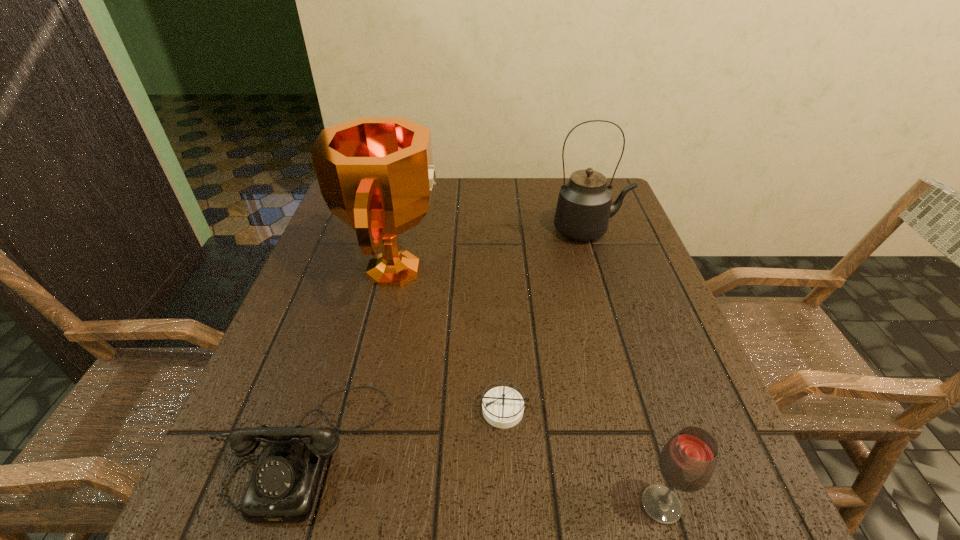
Where is `unoccupied area between the award and the glass drink container`? unoccupied area between the award and the glass drink container is located at coordinates (528, 387).

The width and height of the screenshot is (960, 540). What are the coordinates of `vacant space that's between the third shortest object and the award` in the screenshot? It's located at (528, 387).

Identify the location of empty space between the kettle and the fourth tallest object. This screenshot has width=960, height=540. coord(447,339).

The height and width of the screenshot is (540, 960). Find the location of `object that can be found as the second closest to the telephone`. object that can be found as the second closest to the telephone is located at coordinates (503, 407).

You are a GUI agent. You are given a task and a screenshot of the screen. Output one action in this format:
    pyautogui.click(x=<x>, y=<y>)
    Task: Click on the object that is the fourth closest to the third shortest object
    Image resolution: width=960 pixels, height=540 pixels.
    Given the screenshot: What is the action you would take?
    pyautogui.click(x=584, y=206)

Find the location of a particular element. Image resolution: width=960 pixels, height=540 pixels. free location that satisfies the following two spatial constraints: 1. on the front-facing side of the telephone; 2. on the left side of the glass drink container is located at coordinates (286, 505).

In order to click on vacant space that satisfies the following two spatial constraints: 1. on the side of the third object from right to left with the star emblem; 2. on the right side of the award in this screenshot , I will do `click(365, 408)`.

What are the coordinates of `vacant position in the image that satisfies the following two spatial constraints: 1. on the side of the award with the star emblem; 2. on the back side of the glass drink container` in the screenshot? It's located at (343, 505).

Image resolution: width=960 pixels, height=540 pixels. I want to click on free space that satisfies the following two spatial constraints: 1. on the side of the award with the star emblem; 2. on the front-facing side of the second shortest object, so [x=356, y=447].

Where is `free space that satisfies the following two spatial constraints: 1. on the side of the third tallest object with the star emblem; 2. on the right side of the award`? Image resolution: width=960 pixels, height=540 pixels. free space that satisfies the following two spatial constraints: 1. on the side of the third tallest object with the star emblem; 2. on the right side of the award is located at coordinates (343, 505).